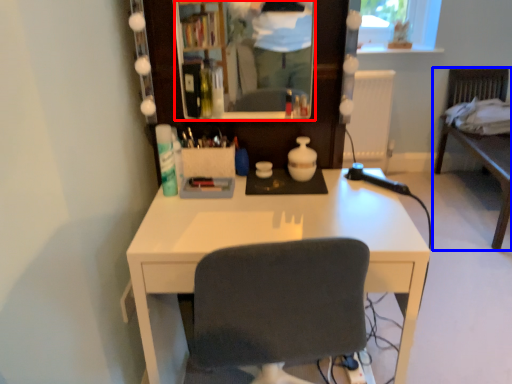
Question: Which object appears farthest to the camera in this image, mirror (highlighted by a red box) or furniture (highlighted by a blue box)?

Choices:
 (A) mirror
 (B) furniture

Answer: (B)